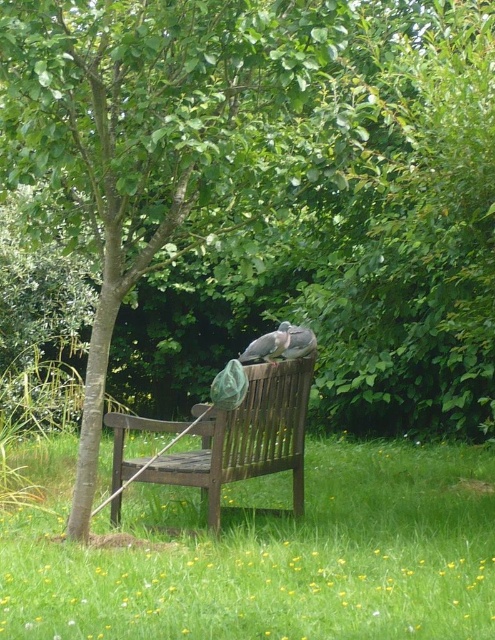
Which is in front, point (261, 436) or point (284, 337)?

Point (284, 337)

Does wooden bench at center have a greater height compared to gray matte pigeon at center?

Yes, wooden bench at center is taller than gray matte pigeon at center.

Identify the location of wooden bench at center. (246, 436).

Does point (129, 476) lie behind point (290, 344)?

No, it is in front of (290, 344).

Which of these two, wooden bench at center or gray feathered pigeon at center, stands shorter?

With less height is gray feathered pigeon at center.

Locate an element on the screen. wooden bench at center is located at coordinates (246, 436).

At what (x,y) coordinates should I click in order to perform the action: click on wooden bench at center. Please return your answer as a coordinate pair (x, y). Image resolution: width=495 pixels, height=640 pixels. Looking at the image, I should click on (246, 436).

Does green grass at center appear under gray feathered pigeon at center?

Indeed, green grass at center is positioned under gray feathered pigeon at center.

You are a GUI agent. You are given a task and a screenshot of the screen. Output one action in this format:
    pyautogui.click(x=<x>, y=<y>)
    Task: Click on the green grass at center
    The height and width of the screenshot is (640, 495).
    Given the screenshot: What is the action you would take?
    pyautogui.click(x=266, y=554)

Locate an element on the screen. The height and width of the screenshot is (640, 495). green grass at center is located at coordinates (266, 554).